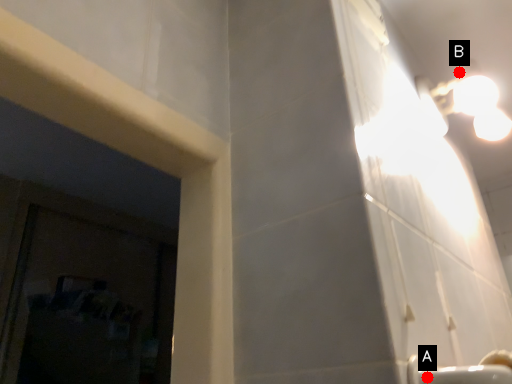
Question: Two points are circled on the image, labeled by A and B beside each circle. Which point appears closest to the camera in this image?

Choices:
 (A) A is closer
 (B) B is closer

Answer: (A)